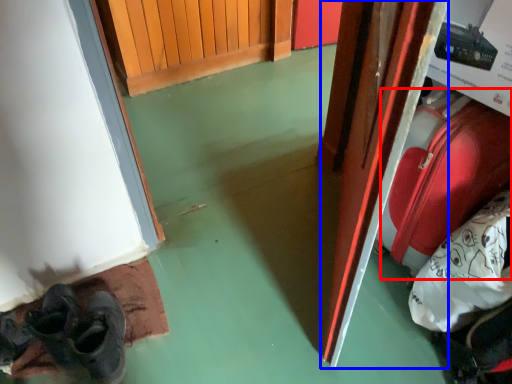
Question: Which of the following is the closest to the observer, luggage (highlighted by a red box) or door (highlighted by a blue box)?

Choices:
 (A) luggage
 (B) door

Answer: (B)